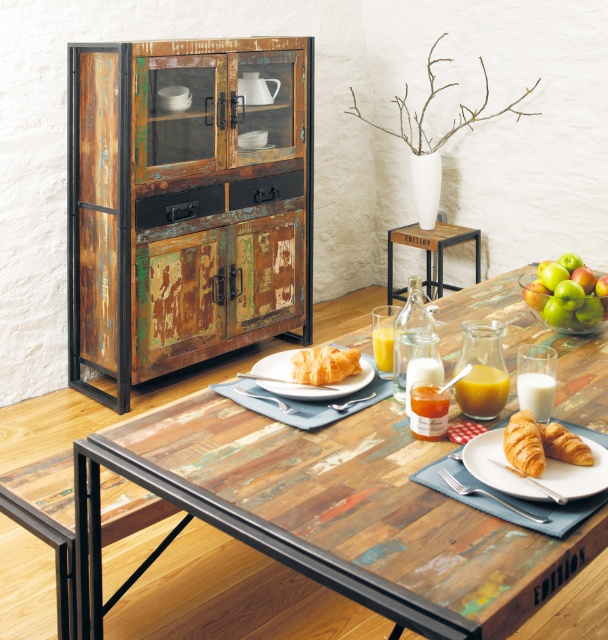
Question: From the image, what is the correct spatial relationship of golden croissant at center in relation to translucent glass bottle of orange juice at table center?

Choices:
 (A) below
 (B) above

Answer: (A)

Question: Estimate the real-world distances between objects in this image. Which object is closer to the wooden table at center?

Choices:
 (A) translucent glass bottle at center
 (B) golden brown flaky croissant at lower right
 (C) translucent glass bottle at table right

Answer: (A)

Question: Among these points, which one is farthest from the camera?

Choices:
 (A) (545, 397)
 (B) (154, 362)
 (C) (505, 468)
 (D) (539, 467)

Answer: (B)

Question: Is golden brown flaky croissant at lower right closer to the viewer compared to translucent glass bottle at table right?

Choices:
 (A) yes
 (B) no

Answer: (A)

Question: Estimate the real-world distances between objects in this image. Which object is closer to the white matte plate at center?

Choices:
 (A) translucent glass bottle at table right
 (B) wooden table at center

Answer: (B)

Question: Observing the image, what is the correct spatial positioning of white matte plate at center in reference to translucent glass bottle at table right?

Choices:
 (A) below
 (B) above

Answer: (B)